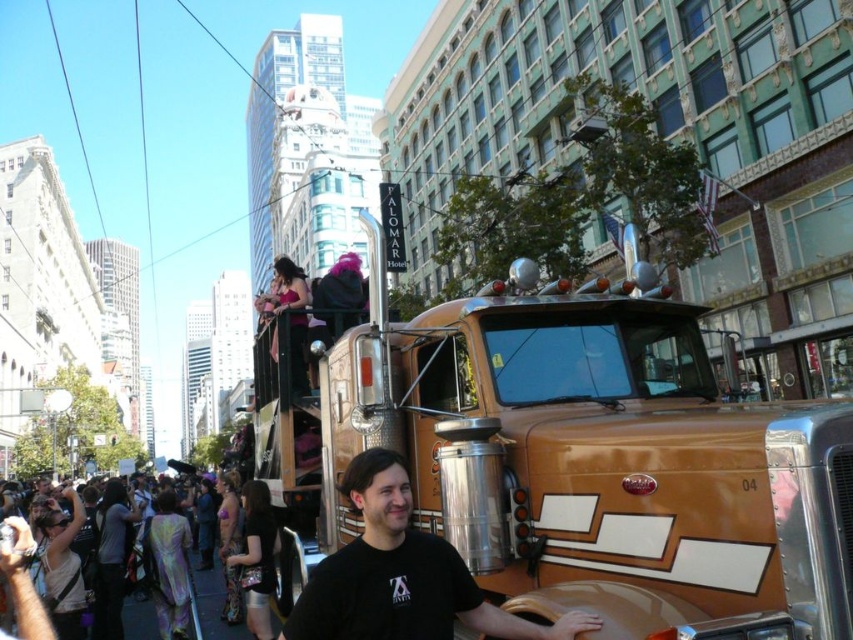
You are a photographer trying to capture both the gold metallic truck at center and the black matte shirt at center in a single frame. Given that your camera has a fixed focal length, which object should you position closer to the camera to ensure both fit in the frame?

Since the gold metallic truck at center is wider than the black matte shirt at center, you should position the gold metallic truck at center closer to the camera. This will make the truck appear smaller in the frame, allowing both objects to fit within the camera view.

You are a drone operator who needs to fly a drone between the gold metallic truck at center and the holographic fabric crowd at lower left. The drone has a maximum flight distance of 40 feet. Can you safely fly the drone between them without exceeding the distance limit?

The gold metallic truck at center is 41.77 feet from the holographic fabric crowd at lower left. Since the drone can only fly up to 40 feet, it cannot safely traverse the distance between them without exceeding its limit.

You are a photographer trying to capture the gold metallic truck at center and the holographic fabric crowd at lower left in a single shot. Based on their positions, which object is closer to the camera?

The holographic fabric crowd at lower left is closer to the camera because the gold metallic truck at center is positioned on the right side of it, indicating it is further away.